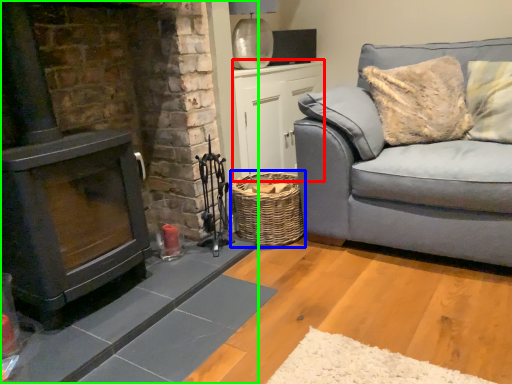
Question: Based on their relative distances, which object is farther from table (highlighted by a red box)? Choose from basket (highlighted by a blue box) and fireplace (highlighted by a green box).

Choices:
 (A) basket
 (B) fireplace

Answer: (B)